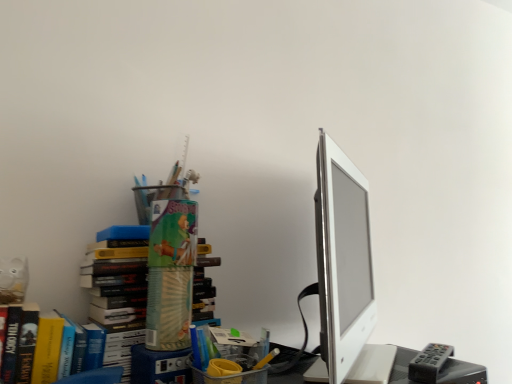
Question: Considering the relative sizes of gray plastic remote at lower right and smooth plastic desk at lower right in the image provided, is gray plastic remote at lower right thinner than smooth plastic desk at lower right?

Choices:
 (A) no
 (B) yes

Answer: (B)

Question: Is gray plastic remote at lower right in front of smooth plastic desk at lower right?

Choices:
 (A) yes
 (B) no

Answer: (B)

Question: From a real-world perspective, is gray plastic remote at lower right located higher than smooth plastic desk at lower right?

Choices:
 (A) no
 (B) yes

Answer: (B)

Question: Is smooth plastic desk at lower right at the back of gray plastic remote at lower right?

Choices:
 (A) no
 (B) yes

Answer: (A)

Question: Can you confirm if gray plastic remote at lower right is smaller than smooth plastic desk at lower right?

Choices:
 (A) yes
 (B) no

Answer: (A)

Question: Is gray plastic remote at lower right in contact with smooth plastic desk at lower right?

Choices:
 (A) yes
 (B) no

Answer: (A)

Question: Considering the relative sizes of white glossy computer monitor at right and gray plastic remote at lower right in the image provided, is white glossy computer monitor at right bigger than gray plastic remote at lower right?

Choices:
 (A) no
 (B) yes

Answer: (B)

Question: From a real-world perspective, is white glossy computer monitor at right on top of gray plastic remote at lower right?

Choices:
 (A) yes
 (B) no

Answer: (A)

Question: From the image's perspective, does white glossy computer monitor at right appear higher than gray plastic remote at lower right?

Choices:
 (A) no
 (B) yes

Answer: (B)

Question: Could you tell me if white glossy computer monitor at right is turned towards gray plastic remote at lower right?

Choices:
 (A) yes
 (B) no

Answer: (A)

Question: Can you confirm if white glossy computer monitor at right is thinner than gray plastic remote at lower right?

Choices:
 (A) no
 (B) yes

Answer: (A)

Question: Considering the relative sizes of white glossy computer monitor at right and gray plastic remote at lower right in the image provided, is white glossy computer monitor at right shorter than gray plastic remote at lower right?

Choices:
 (A) no
 (B) yes

Answer: (A)

Question: Does gray plastic remote at lower right lie behind white glossy computer monitor at right?

Choices:
 (A) yes
 (B) no

Answer: (A)